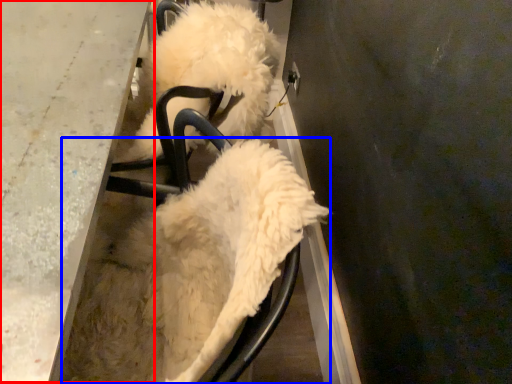
Question: Which object appears closest to the camera in this image, table (highlighted by a red box) or dog (highlighted by a blue box)?

Choices:
 (A) table
 (B) dog

Answer: (B)